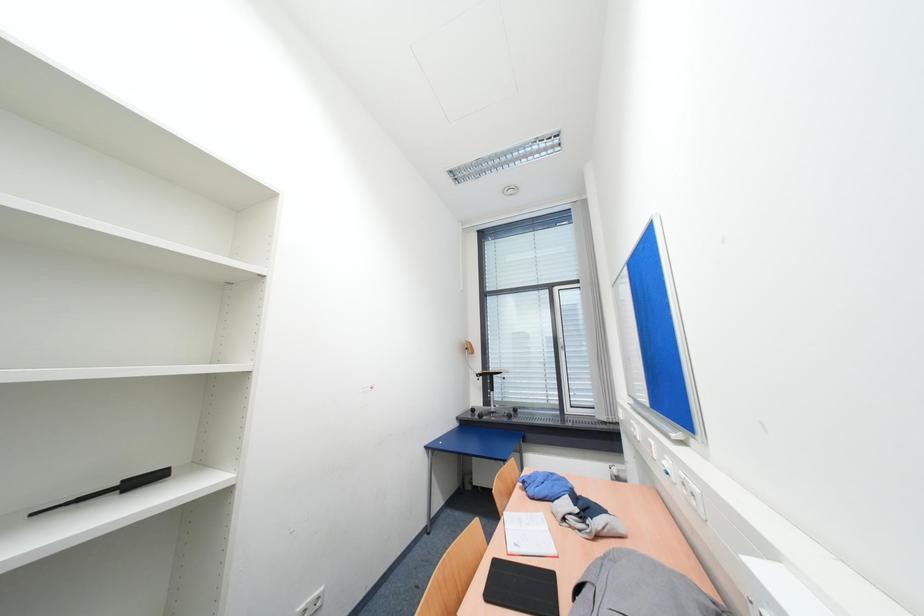
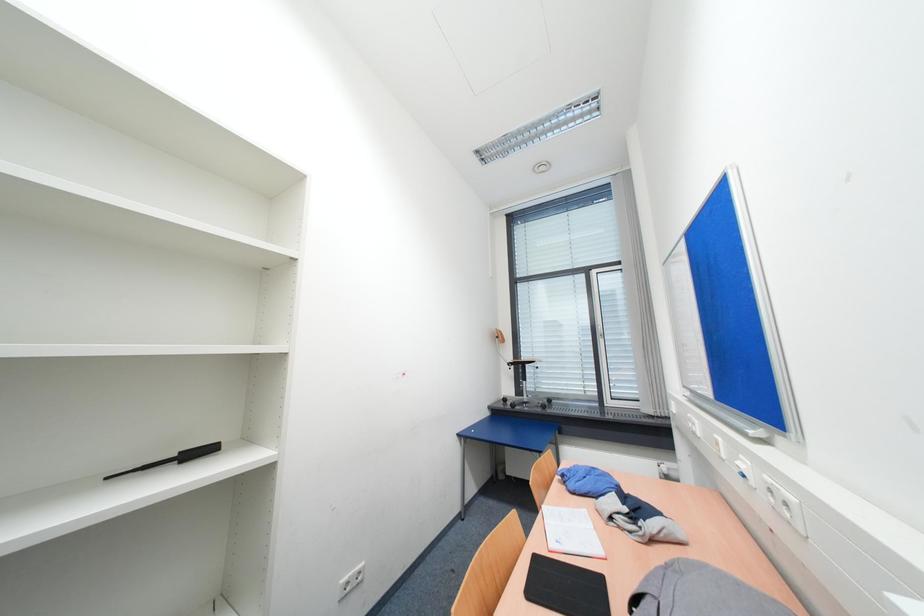
Question: Which direction would the cameraman need to move to produce the second image? Reply with the corresponding letter.

Choices:
 (A) Left
 (B) Right
 (C) Forward
 (D) Backward

Answer: (C)